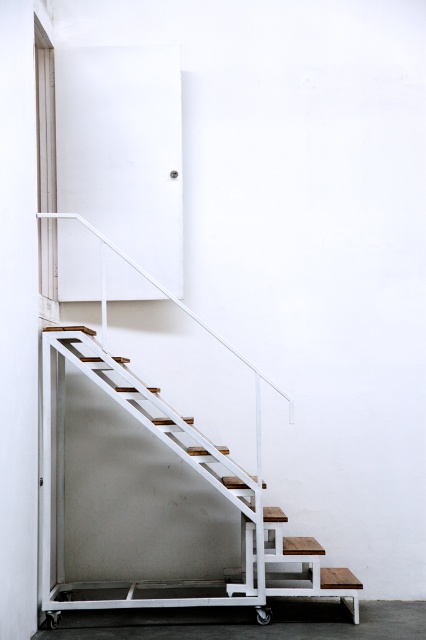
Does wooden stairs at center come in front of black rubber wheel at lower center?

Yes, it is.

Is wooden stairs at center taller than black rubber wheel at lower center?

Yes, wooden stairs at center is taller than black rubber wheel at lower center.

Is point (63, 508) farther from camera compared to point (259, 608)?

Yes.

In order to click on wooden stairs at center in this screenshot , I will do `click(193, 468)`.